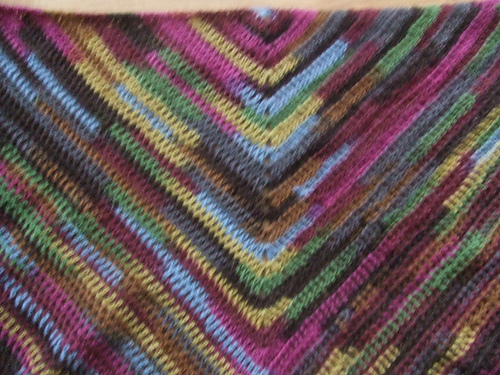
Image resolution: width=500 pixels, height=375 pixels. What are the coordinates of `center of blanket pattern` in the screenshot? It's located at (265, 12).